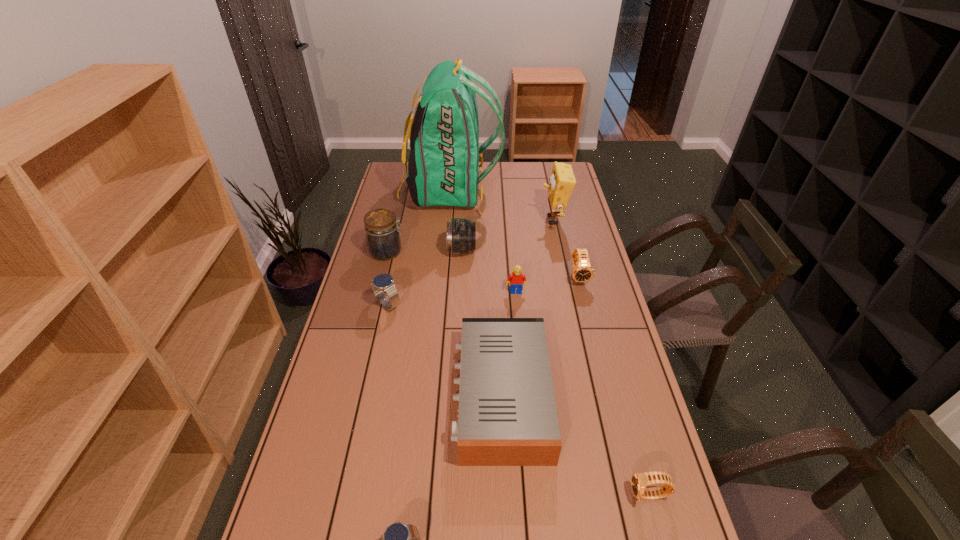
The width and height of the screenshot is (960, 540). Identify the location of the smaller black watch. point(639,481).

I want to click on the second nearest object, so click(x=639, y=481).

Image resolution: width=960 pixels, height=540 pixels. In order to click on vacant point located on the back of the tallest object in this screenshot , I will do `click(569, 192)`.

You are a GUI agent. You are given a task and a screenshot of the screen. Output one action in this format:
    pyautogui.click(x=<x>, y=<y>)
    Task: Click on the free space located on the face of the second tallest object
    
    Given the screenshot: What is the action you would take?
    pyautogui.click(x=482, y=220)

Where is `free spot located on the face of the second tallest object`? The height and width of the screenshot is (540, 960). free spot located on the face of the second tallest object is located at coordinates (475, 220).

I want to click on blank space located 0.140m on the face of the second tallest object, so click(507, 220).

Find the location of a particular element. The image size is (960, 540). vacant space located on the lid of the jar is located at coordinates (461, 252).

The height and width of the screenshot is (540, 960). Find the location of `blank space located at the front element of the telephoto lens`. blank space located at the front element of the telephoto lens is located at coordinates (516, 250).

Where is `vacant position located 0.390m on the face of the sixth nearest object`? The width and height of the screenshot is (960, 540). vacant position located 0.390m on the face of the sixth nearest object is located at coordinates (604, 379).

Image resolution: width=960 pixels, height=540 pixels. I want to click on vacant space located on the face of the Lego, so click(x=517, y=313).